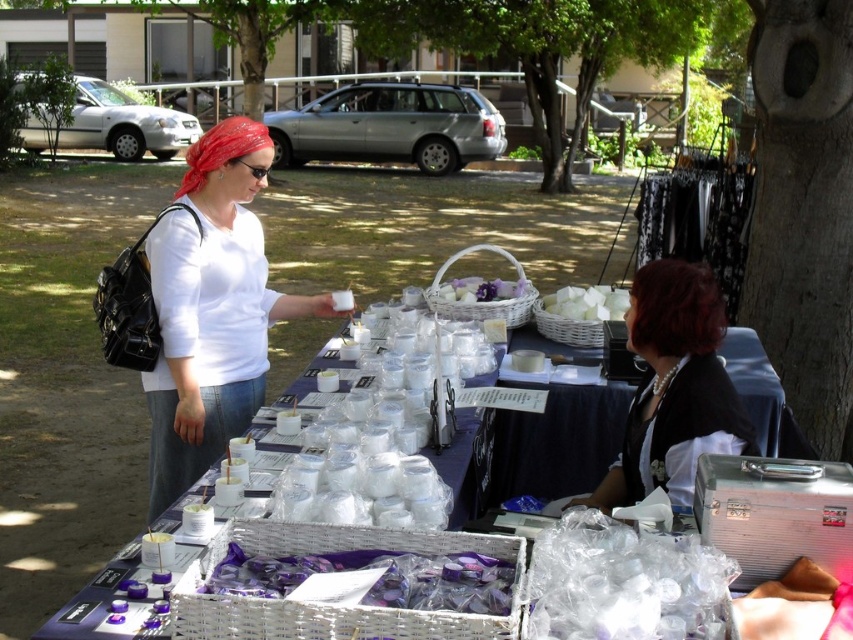
Based on the photo, you are a customer at the market and want to place a small item on the shiny red bandana at upper left and the white matte basket at center. Which surface can accommodate a wider item?

The shiny red bandana at upper left can accommodate a wider item since its width surpasses that of the white matte basket at center.